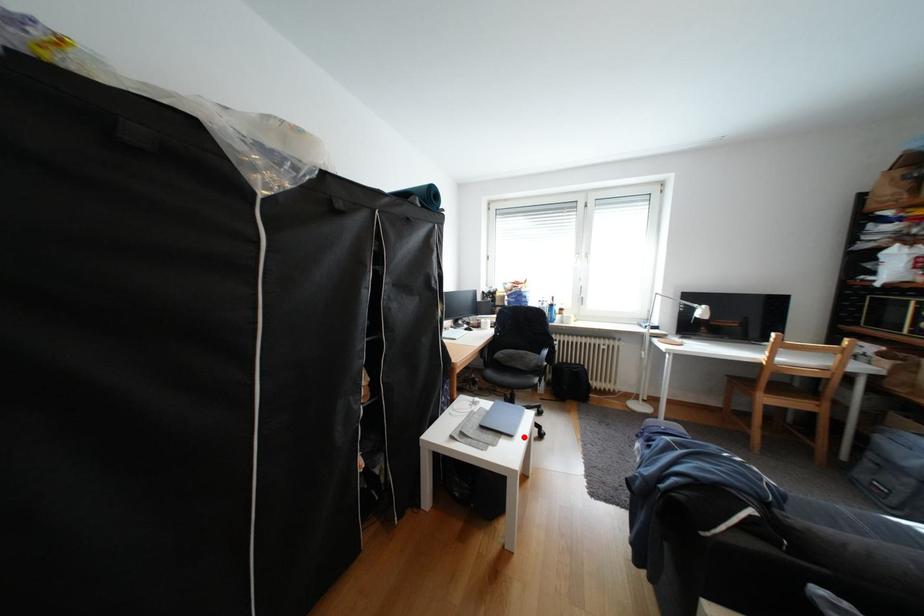
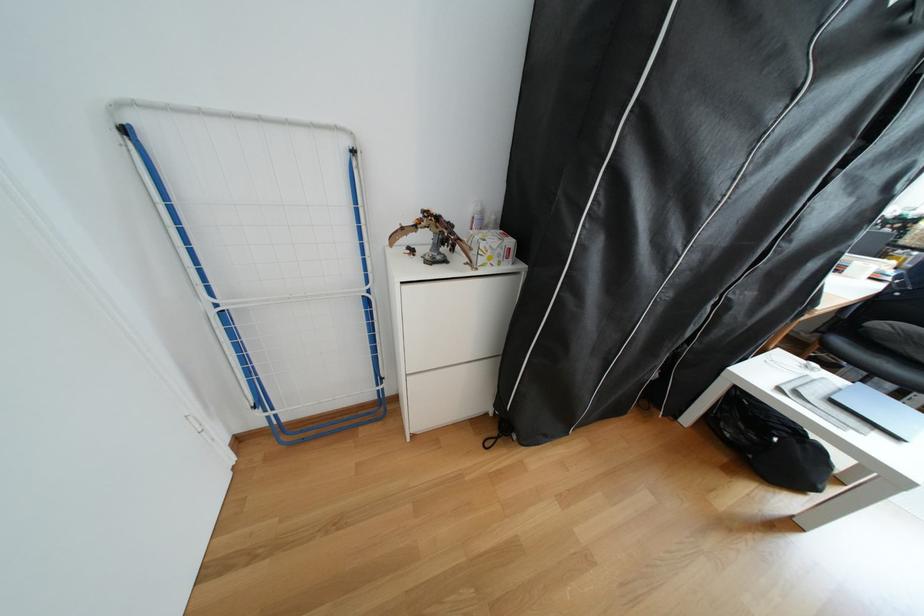
Question: I am providing you with two images of the same scene from different viewpoints. Given a red point in image1, look at the same physical point in image2. Is it:

Choices:
 (A) Closer to the viewpoint
 (B) Farther from the viewpoint

Answer: (A)